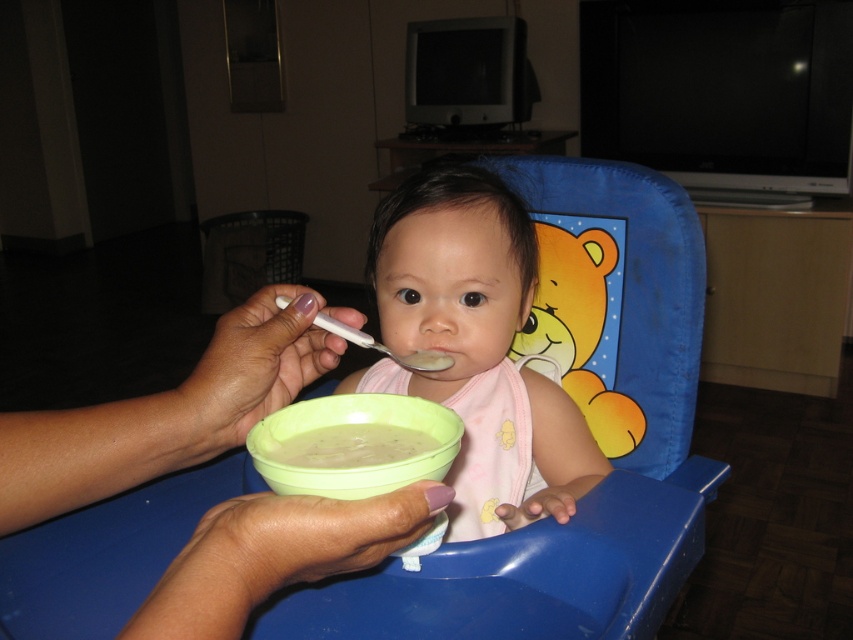
Is pink fabric baby at center below green plastic bowl at center?

Actually, pink fabric baby at center is above green plastic bowl at center.

Between point (424, 189) and point (297, 488), which one is positioned in front?

Point (297, 488) is in front.

Is point (508, 285) behind point (289, 406)?

Yes, point (508, 285) is farther from viewer.

The width and height of the screenshot is (853, 640). I want to click on pink fabric baby at center, so click(x=474, y=346).

Measure the distance between white creamy soup at center and white plastic spoon at center.

white creamy soup at center and white plastic spoon at center are 5.07 inches apart from each other.

Between point (328, 467) and point (363, 336), which one is positioned in front?

Positioned in front is point (328, 467).

What do you see at coordinates (351, 445) in the screenshot? I see `white creamy soup at center` at bounding box center [351, 445].

The height and width of the screenshot is (640, 853). Find the location of `white creamy soup at center`. white creamy soup at center is located at coordinates (351, 445).

Is pink fabric baby at center below white creamy soup at center?

Incorrect, pink fabric baby at center is not positioned below white creamy soup at center.

This screenshot has width=853, height=640. In order to click on pink fabric baby at center in this screenshot , I will do `click(474, 346)`.